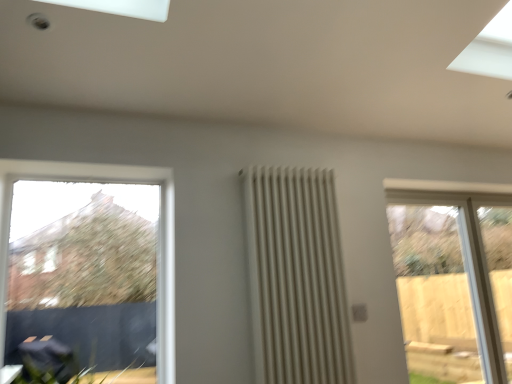
Locate an element on the screen. white matte radiator at center is located at coordinates (296, 277).

Identify the location of clear glass door at right, the second window from the front. (454, 277).

The image size is (512, 384). I want to click on clear glass window at left, the 2th window when ordered from right to left, so click(x=160, y=229).

What do you see at coordinates (160, 229) in the screenshot? This screenshot has height=384, width=512. I see `clear glass window at left, the 2th window when ordered from right to left` at bounding box center [160, 229].

Image resolution: width=512 pixels, height=384 pixels. In order to click on white matte radiator at center in this screenshot , I will do `click(296, 277)`.

Which of these two, clear glass door at right, the second window from the front, or white matte radiator at center, stands taller?

Standing taller between the two is clear glass door at right, the second window from the front.

Can you confirm if clear glass door at right, the second window from the front, is thinner than white matte radiator at center?

No, clear glass door at right, the second window from the front, is not thinner than white matte radiator at center.

From a real-world perspective, which is physically below, clear glass door at right, marked as the first window in a right-to-left arrangement, or white matte radiator at center?

clear glass door at right, marked as the first window in a right-to-left arrangement.

Is white matte radiator at center inside clear glass door at right, marked as the first window in a right-to-left arrangement?

No.

Measure the distance from clear glass door at right, positioned as the 2th window in left-to-right order, to clear glass window at left, positioned as the 2th window in back-to-front order.

The distance of clear glass door at right, positioned as the 2th window in left-to-right order, from clear glass window at left, positioned as the 2th window in back-to-front order, is 3.25 meters.

From a real-world perspective, is clear glass door at right, the first window positioned from the back, physically located above or below clear glass window at left, positioned as the 2th window in back-to-front order?

From a real-world perspective, clear glass door at right, the first window positioned from the back, is physically below clear glass window at left, positioned as the 2th window in back-to-front order.

Is there a large distance between clear glass door at right, positioned as the 2th window in left-to-right order, and clear glass window at left, positioned as the 2th window in back-to-front order?

clear glass door at right, positioned as the 2th window in left-to-right order, is far away from clear glass window at left, positioned as the 2th window in back-to-front order.

Does clear glass door at right, positioned as the 2th window in left-to-right order, have a greater width compared to clear glass window at left, arranged as the first window when viewed from the front?

Correct, the width of clear glass door at right, positioned as the 2th window in left-to-right order, exceeds that of clear glass window at left, arranged as the first window when viewed from the front.

From a real-world perspective, who is located lower, white matte radiator at center or clear glass window at left, arranged as the first window when viewed from the front?

In real-world perspective, white matte radiator at center is lower.

Locate an element on the screen. radiator above the clear glass window at left, the 2th window when ordered from right to left (from the image's perspective) is located at coordinates (296, 277).

In the scene shown: Is clear glass window at left, arranged as the first window when viewed from the front, inside white matte radiator at center?

No, clear glass window at left, arranged as the first window when viewed from the front, is not surrounded by white matte radiator at center.

Which is behind, point (259, 267) or point (38, 162)?

The point (259, 267) is more distant.

Between point (312, 325) and point (453, 195), which one is positioned behind?

Point (453, 195)

From the picture: What's the angular difference between white matte radiator at center and clear glass door at right, marked as the first window in a right-to-left arrangement,'s facing directions?

2.15 degrees.

Which is more to the left, white matte radiator at center or clear glass door at right, the first window positioned from the back?

white matte radiator at center is more to the left.

Is white matte radiator at center oriented towards clear glass door at right, the second window from the front?

No, white matte radiator at center does not turn towards clear glass door at right, the second window from the front.

From the picture: Is clear glass window at left, positioned as the 2th window in back-to-front order, taller or shorter than clear glass door at right, marked as the first window in a right-to-left arrangement?

clear glass window at left, positioned as the 2th window in back-to-front order, is shorter than clear glass door at right, marked as the first window in a right-to-left arrangement.

Can you tell me how much clear glass window at left, marked as the first window in a left-to-right arrangement, and clear glass door at right, the second window from the front, differ in facing direction?

They differ by 0.133 degrees in their facing directions.

Which is closer to the camera, (85, 168) or (507, 332)?

Clearly, point (85, 168) is closer to the camera than point (507, 332).

The width and height of the screenshot is (512, 384). In order to click on radiator behind the clear glass window at left, positioned as the 2th window in back-to-front order in this screenshot , I will do `click(296, 277)`.

Which object is positioned more to the right, clear glass window at left, the 2th window when ordered from right to left, or white matte radiator at center?

white matte radiator at center.

Considering the sizes of clear glass window at left, positioned as the 2th window in back-to-front order, and white matte radiator at center in the image, is clear glass window at left, positioned as the 2th window in back-to-front order, taller or shorter than white matte radiator at center?

In the image, clear glass window at left, positioned as the 2th window in back-to-front order, appears to be shorter than white matte radiator at center.

Is point (158, 308) closer to viewer compared to point (334, 301)?

Yes.

Find the location of a particular element. window that appears behind the white matte radiator at center is located at coordinates (454, 277).

Locate an element on the screen. The width and height of the screenshot is (512, 384). window lying on the right of clear glass window at left, arranged as the first window when viewed from the front is located at coordinates (454, 277).

Estimate the real-world distances between objects in this image. Which object is further from clear glass door at right, the first window positioned from the back, clear glass window at left, marked as the first window in a left-to-right arrangement, or white matte radiator at center?

Based on the image, clear glass window at left, marked as the first window in a left-to-right arrangement, appears to be further to clear glass door at right, the first window positioned from the back.

Which object lies further to the anchor point clear glass door at right, the second window from the front, white matte radiator at center or clear glass window at left, positioned as the 2th window in back-to-front order?

clear glass window at left, positioned as the 2th window in back-to-front order, is further to clear glass door at right, the second window from the front.

Which object lies further to the anchor point clear glass window at left, the 2th window when ordered from right to left, clear glass door at right, the second window from the front, or white matte radiator at center?

Result: Based on the image, clear glass door at right, the second window from the front, appears to be further to clear glass window at left, the 2th window when ordered from right to left.

Which object lies further to the anchor point clear glass window at left, arranged as the first window when viewed from the front, white matte radiator at center or clear glass door at right, marked as the first window in a right-to-left arrangement?

clear glass door at right, marked as the first window in a right-to-left arrangement, is positioned further to the anchor clear glass window at left, arranged as the first window when viewed from the front.

Considering their positions, is clear glass window at left, marked as the first window in a left-to-right arrangement, positioned closer to white matte radiator at center than clear glass door at right, the second window from the front?

Among the two, clear glass window at left, marked as the first window in a left-to-right arrangement, is located nearer to white matte radiator at center.

When comparing their distances from white matte radiator at center, does clear glass door at right, positioned as the 2th window in left-to-right order, or clear glass window at left, marked as the first window in a left-to-right arrangement, seem closer?

clear glass window at left, marked as the first window in a left-to-right arrangement, is closer to white matte radiator at center.

Identify the location of radiator situated between clear glass window at left, the 2th window when ordered from right to left, and clear glass door at right, the first window positioned from the back, from left to right. (296, 277).